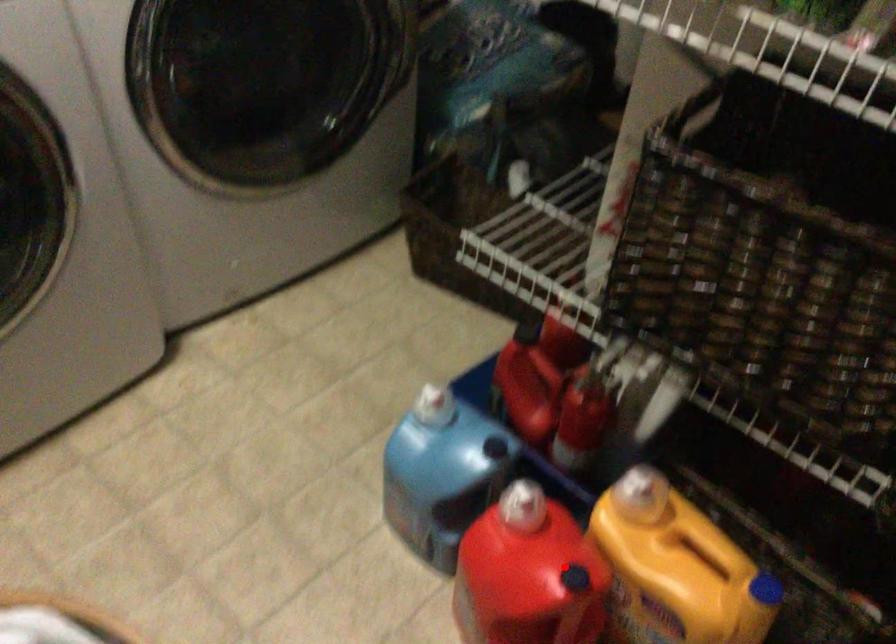
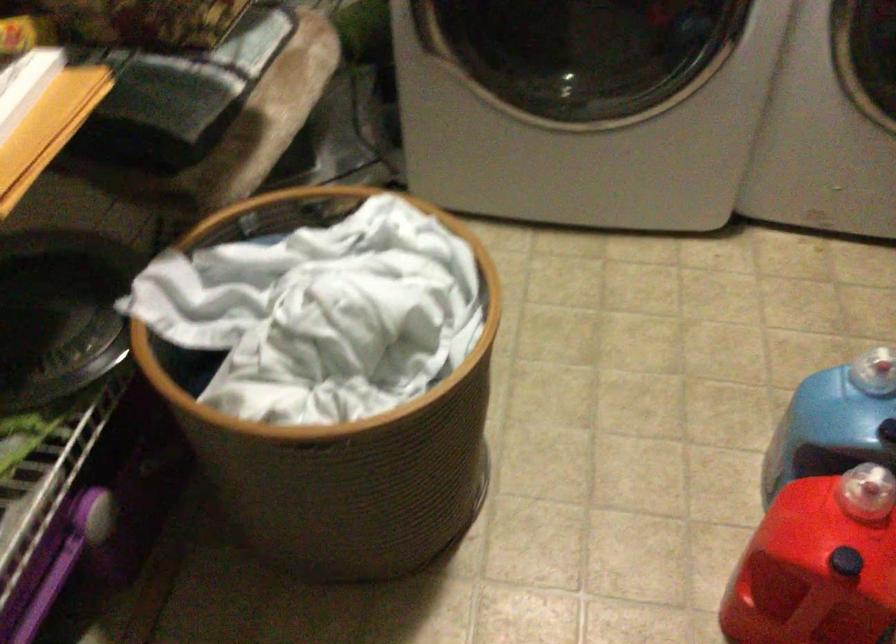
Question: I am providing you with two images of the same scene from different viewpoints. A red point is marked on the first image. Is the red point's position out of view in image 2?

Choices:
 (A) Yes
 (B) No

Answer: (B)